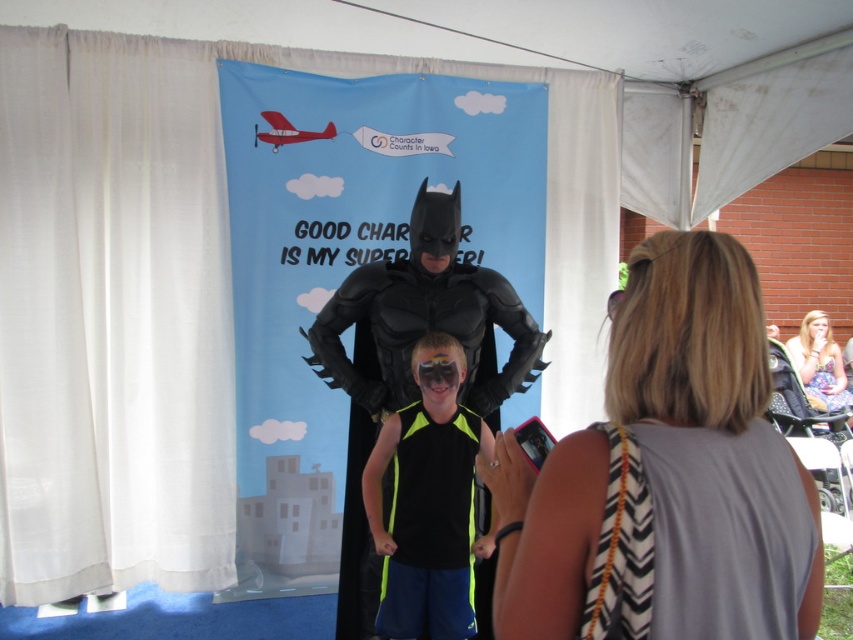
Is point (729, 552) closer to viewer compared to point (392, 589)?

Yes.

Find the location of `gray fabric tank top at center`. gray fabric tank top at center is located at coordinates (670, 470).

Is gray fabric tank top at center taller than black matte costume at center?

Incorrect, gray fabric tank top at center's height is not larger of black matte costume at center's.

Does point (752, 592) come farther from viewer compared to point (340, 630)?

No, it is not.

In order to click on gray fabric tank top at center in this screenshot , I will do `click(670, 470)`.

Can you confirm if black matte tank top at center is positioned below floral dress at lower right?

Yes, black matte tank top at center is below floral dress at lower right.

Which is behind, point (436, 552) or point (819, 385)?

Point (819, 385)

Find the location of a particular element. The height and width of the screenshot is (640, 853). black matte tank top at center is located at coordinates (430, 528).